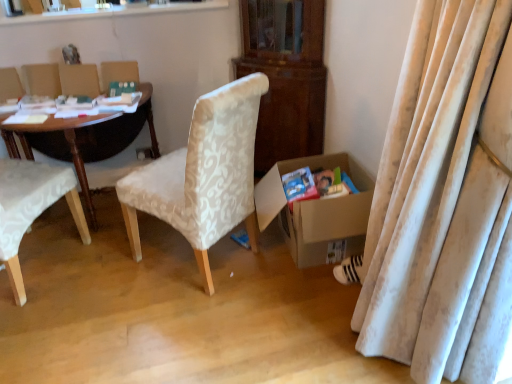
Question: From the image's perspective, is white fabric chair at left, which ranks as the 1th chair in left-to-right order, beneath matte blue paperback book at lower right, acting as the second paperback book starting from the left?

Choices:
 (A) yes
 (B) no

Answer: (B)

Question: From a real-world perspective, is white fabric chair at left, the 2th chair viewed from the right, positioned over matte blue paperback book at lower right, positioned as the first paperback book in right-to-left order, based on gravity?

Choices:
 (A) yes
 (B) no

Answer: (A)

Question: Is white fabric chair at left, which ranks as the 1th chair in left-to-right order, further to camera compared to matte blue paperback book at lower right, the 2th paperback book viewed from the back?

Choices:
 (A) yes
 (B) no

Answer: (B)

Question: Considering the relative sizes of white fabric chair at left, the 2th chair viewed from the right, and matte blue paperback book at lower right, acting as the second paperback book starting from the left, in the image provided, is white fabric chair at left, the 2th chair viewed from the right, thinner than matte blue paperback book at lower right, acting as the second paperback book starting from the left,?

Choices:
 (A) yes
 (B) no

Answer: (B)

Question: Does white fabric chair at left, the 2th chair viewed from the right, appear on the left side of matte blue paperback book at lower right, positioned as the first paperback book in right-to-left order?

Choices:
 (A) yes
 (B) no

Answer: (A)

Question: Considering the relative positions of white fabric chair at left, which ranks as the 1th chair in left-to-right order, and matte blue paperback book at lower right, positioned as the first paperback book in right-to-left order, in the image provided, is white fabric chair at left, which ranks as the 1th chair in left-to-right order, in front of matte blue paperback book at lower right, positioned as the first paperback book in right-to-left order,?

Choices:
 (A) yes
 (B) no

Answer: (A)

Question: Can you see white striped fabric sneakers at lower right touching matte cardboard magazine at lower right?

Choices:
 (A) yes
 (B) no

Answer: (B)

Question: Is white striped fabric sneakers at lower right looking in the opposite direction of matte cardboard magazine at lower right?

Choices:
 (A) yes
 (B) no

Answer: (B)

Question: From the image's perspective, is white striped fabric sneakers at lower right on matte cardboard magazine at lower right?

Choices:
 (A) no
 (B) yes

Answer: (A)

Question: Can you confirm if white striped fabric sneakers at lower right is wider than matte cardboard magazine at lower right?

Choices:
 (A) yes
 (B) no

Answer: (B)

Question: Can we say white striped fabric sneakers at lower right lies outside matte cardboard magazine at lower right?

Choices:
 (A) no
 (B) yes

Answer: (B)

Question: Considering the relative positions of white striped fabric sneakers at lower right and matte cardboard magazine at lower right in the image provided, is white striped fabric sneakers at lower right to the left of matte cardboard magazine at lower right from the viewer's perspective?

Choices:
 (A) no
 (B) yes

Answer: (A)

Question: Can you confirm if green matte paperback book at upper left, positioned as the first paperback book in top-to-bottom order, is wider than white textured fabric chair at center, which is the second chair in left-to-right order?

Choices:
 (A) yes
 (B) no

Answer: (B)